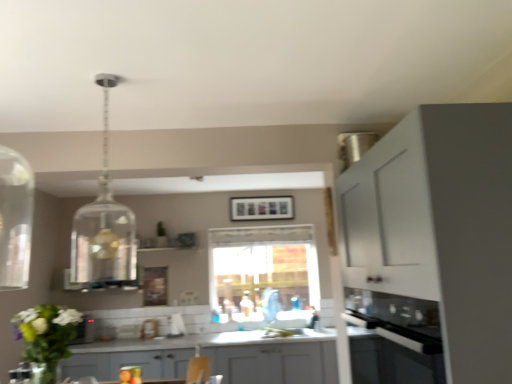
Question: Is white matte cabinet at right, which is counted as the second cabinetry, starting from the bottom, thinner than translucent glass bottle at center?

Choices:
 (A) yes
 (B) no

Answer: (B)

Question: Considering the relative sizes of white matte cabinet at right, arranged as the second cabinetry when viewed from the back, and translucent glass bottle at center in the image provided, is white matte cabinet at right, arranged as the second cabinetry when viewed from the back, taller than translucent glass bottle at center?

Choices:
 (A) no
 (B) yes

Answer: (B)

Question: Is white matte cabinet at right, which is counted as the second cabinetry, starting from the bottom, at the left side of translucent glass bottle at center?

Choices:
 (A) yes
 (B) no

Answer: (B)

Question: Is white matte cabinet at right, which is the 1th cabinetry in top-to-bottom order, completely or partially outside of translucent glass bottle at center?

Choices:
 (A) yes
 (B) no

Answer: (A)

Question: From the image's perspective, is white matte cabinet at right, which is counted as the second cabinetry, starting from the bottom, located beneath translucent glass bottle at center?

Choices:
 (A) yes
 (B) no

Answer: (B)

Question: From a real-world perspective, is white matte cabinet at right, the 1th cabinetry when ordered from front to back, physically located above or below gray matte cabinet at center, which ranks as the first cabinetry in back-to-front order?

Choices:
 (A) above
 (B) below

Answer: (A)

Question: Does point [x=489, y=266] appear closer or farther from the camera than point [x=328, y=367]?

Choices:
 (A) closer
 (B) farther

Answer: (A)

Question: Looking at the image, does white matte cabinet at right, which is counted as the second cabinetry, starting from the bottom, seem bigger or smaller compared to gray matte cabinet at center, which is the 2th cabinetry from top to bottom?

Choices:
 (A) small
 (B) big

Answer: (A)

Question: From the image's perspective, is white matte cabinet at right, arranged as the second cabinetry when viewed from the back, positioned above or below gray matte cabinet at center, which ranks as the first cabinetry in back-to-front order?

Choices:
 (A) above
 (B) below

Answer: (A)

Question: Looking at the image, does matte black picture frame at center seem bigger or smaller compared to clear glass pendant light at upper center?

Choices:
 (A) big
 (B) small

Answer: (B)

Question: From a real-world perspective, is matte black picture frame at center physically located above or below clear glass pendant light at upper center?

Choices:
 (A) below
 (B) above

Answer: (B)

Question: Is matte black picture frame at center taller or shorter than clear glass pendant light at upper center?

Choices:
 (A) tall
 (B) short

Answer: (B)

Question: Is point (272, 215) positioned closer to the camera than point (95, 233)?

Choices:
 (A) closer
 (B) farther

Answer: (B)

Question: Considering the relative positions of black glass oven at lower right and white matte cabinet at right, which is counted as the second cabinetry, starting from the bottom, in the image provided, is black glass oven at lower right to the left or to the right of white matte cabinet at right, which is counted as the second cabinetry, starting from the bottom,?

Choices:
 (A) left
 (B) right

Answer: (A)

Question: Considering the positions of black glass oven at lower right and white matte cabinet at right, the 1th cabinetry when ordered from front to back, in the image, is black glass oven at lower right taller or shorter than white matte cabinet at right, the 1th cabinetry when ordered from front to back,?

Choices:
 (A) short
 (B) tall

Answer: (A)